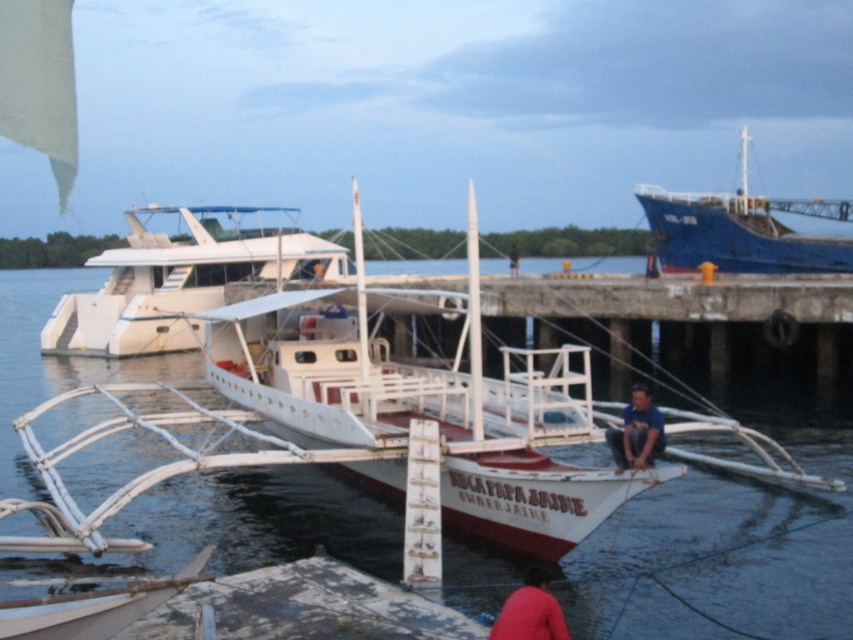
Question: Does red fabric shirt at lower center have a smaller size compared to dark blue shirt at center?

Choices:
 (A) no
 (B) yes

Answer: (B)

Question: Does blue fabric shirt at center lie in front of dark blue shirt at center?

Choices:
 (A) yes
 (B) no

Answer: (A)

Question: Estimate the real-world distances between objects in this image. Which object is farther from the blue fabric shirt at center?

Choices:
 (A) red fabric shirt at lower center
 (B) transparent water at boat center

Answer: (B)

Question: Does white matte yacht at center appear over dark blue shirt at center?

Choices:
 (A) yes
 (B) no

Answer: (A)

Question: Which point is farther from the camera taking this photo?

Choices:
 (A) (273, 243)
 (B) (563, 625)
 (C) (338, 536)
 (D) (624, 445)

Answer: (A)

Question: Which of the following is the closest to the observer?

Choices:
 (A) dark blue shirt at center
 (B) red fabric shirt at lower center

Answer: (B)